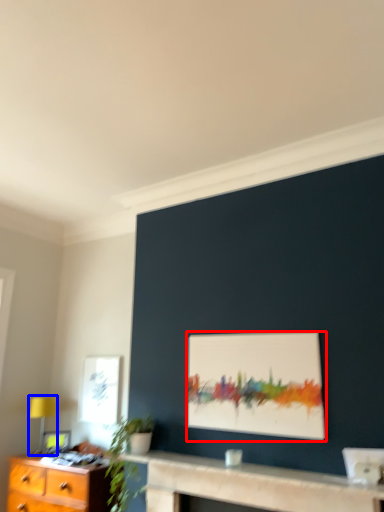
Question: Among these objects, which one is nearest to the camera, picture frame (highlighted by a red box) or table lamp (highlighted by a blue box)?

Choices:
 (A) picture frame
 (B) table lamp

Answer: (A)